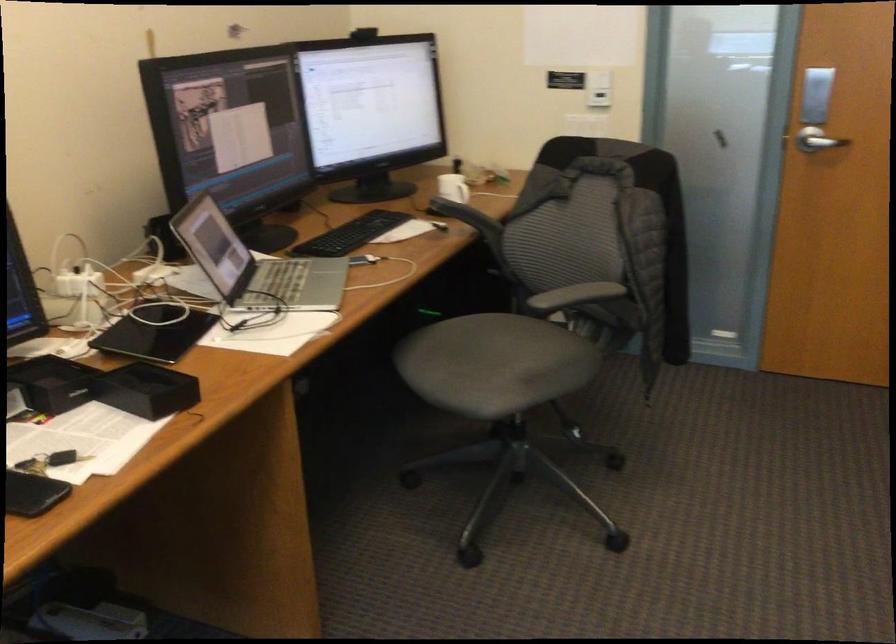
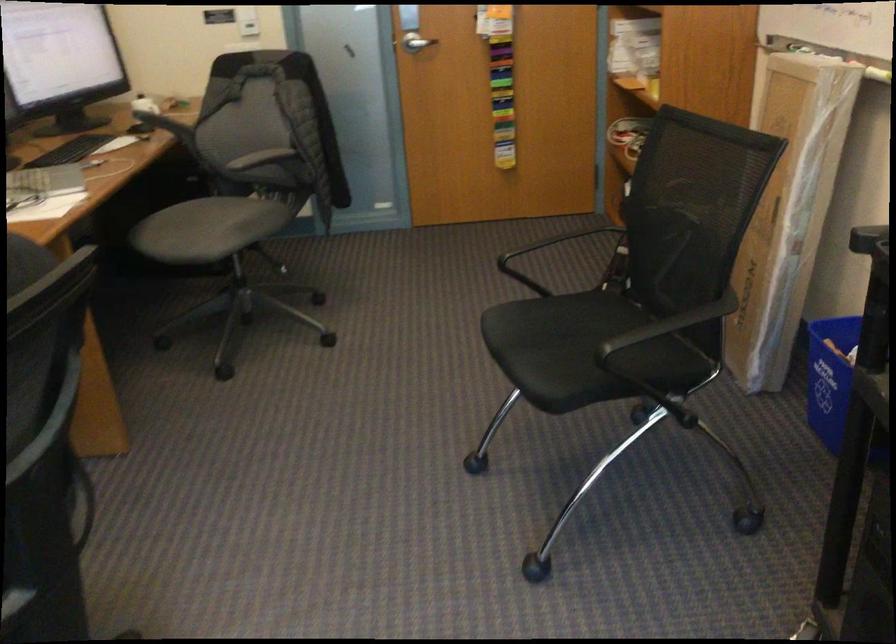
Where in the second image is the point corresponding to (819,147) from the first image?

(415, 43)